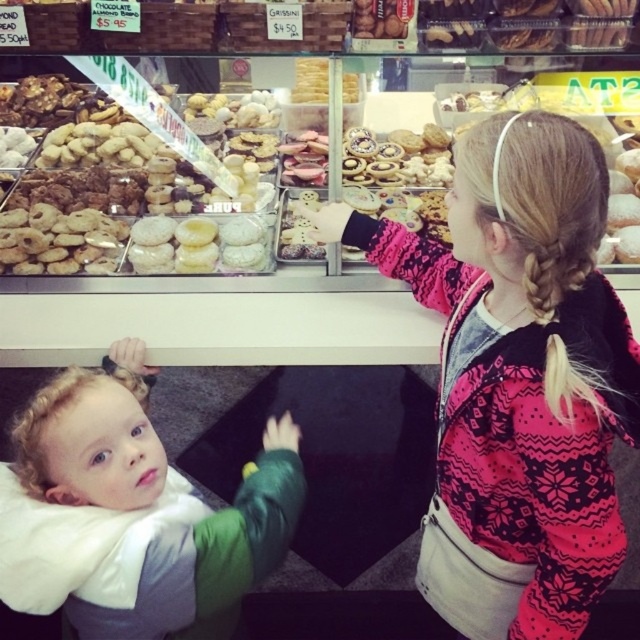
Question: Observing the image, what is the correct spatial positioning of pink sweater at upper right in reference to curly blonde hair at lower left?

Choices:
 (A) below
 (B) above

Answer: (B)

Question: Which point appears farthest from the camera in this image?

Choices:
 (A) (500, 129)
 (B) (260, 552)

Answer: (B)

Question: Is pink sweater at upper right wider than curly blonde hair at lower left?

Choices:
 (A) yes
 (B) no

Answer: (B)

Question: Does pink sweater at upper right lie behind curly blonde hair at lower left?

Choices:
 (A) no
 (B) yes

Answer: (A)

Question: Which point is farther to the camera?

Choices:
 (A) curly blonde hair at lower left
 (B) pink sweater at upper right

Answer: (A)